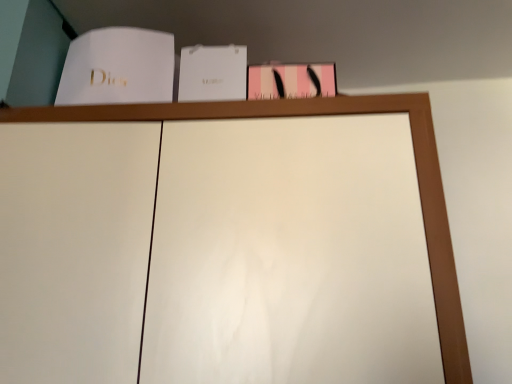
Question: Can you confirm if white paper at upper left, which is the 2th paperback book in right-to-left order, is thinner than white paper at center, the second paperback book in the left-to-right sequence?

Choices:
 (A) yes
 (B) no

Answer: (B)

Question: From a real-world perspective, is white paper at upper left, which is the 2th paperback book in right-to-left order, below white paper at center, the 1th paperback book from the right?

Choices:
 (A) yes
 (B) no

Answer: (B)

Question: Does white paper at upper left, which is the 2th paperback book in right-to-left order, have a larger size compared to white paper at center, the 1th paperback book from the right?

Choices:
 (A) yes
 (B) no

Answer: (A)

Question: Is white paper at upper left, which is the 2th paperback book in right-to-left order, taller than white paper at center, the second paperback book in the left-to-right sequence?

Choices:
 (A) yes
 (B) no

Answer: (A)

Question: Is white paper at upper left, placed as the first paperback book when sorted from left to right, positioned far away from white paper at center, the 1th paperback book from the right?

Choices:
 (A) yes
 (B) no

Answer: (B)

Question: Considering the relative positions of white paper at upper left, placed as the first paperback book when sorted from left to right, and white paper at center, the 1th paperback book from the right, in the image provided, is white paper at upper left, placed as the first paperback book when sorted from left to right, behind white paper at center, the 1th paperback book from the right,?

Choices:
 (A) yes
 (B) no

Answer: (B)

Question: Is white paper at center, the 1th paperback book from the right, wider than white paper at upper left, which is the 2th paperback book in right-to-left order?

Choices:
 (A) no
 (B) yes

Answer: (A)

Question: Can you confirm if white paper at center, the second paperback book in the left-to-right sequence, is bigger than white paper at upper left, which is the 2th paperback book in right-to-left order?

Choices:
 (A) yes
 (B) no

Answer: (B)

Question: Does white paper at center, the second paperback book in the left-to-right sequence, turn towards white paper at upper left, placed as the first paperback book when sorted from left to right?

Choices:
 (A) no
 (B) yes

Answer: (A)

Question: From the image's perspective, does white paper at center, the second paperback book in the left-to-right sequence, appear lower than white paper at upper left, which is the 2th paperback book in right-to-left order?

Choices:
 (A) yes
 (B) no

Answer: (A)

Question: Does white paper at center, the 1th paperback book from the right, come behind white paper at upper left, placed as the first paperback book when sorted from left to right?

Choices:
 (A) yes
 (B) no

Answer: (A)

Question: Is white paper at center, the second paperback book in the left-to-right sequence, with white paper at upper left, which is the 2th paperback book in right-to-left order?

Choices:
 (A) yes
 (B) no

Answer: (B)

Question: From their relative heights in the image, would you say white paper at center, the 1th paperback book from the right, is taller or shorter than white paper at upper left, placed as the first paperback book when sorted from left to right?

Choices:
 (A) short
 (B) tall

Answer: (A)